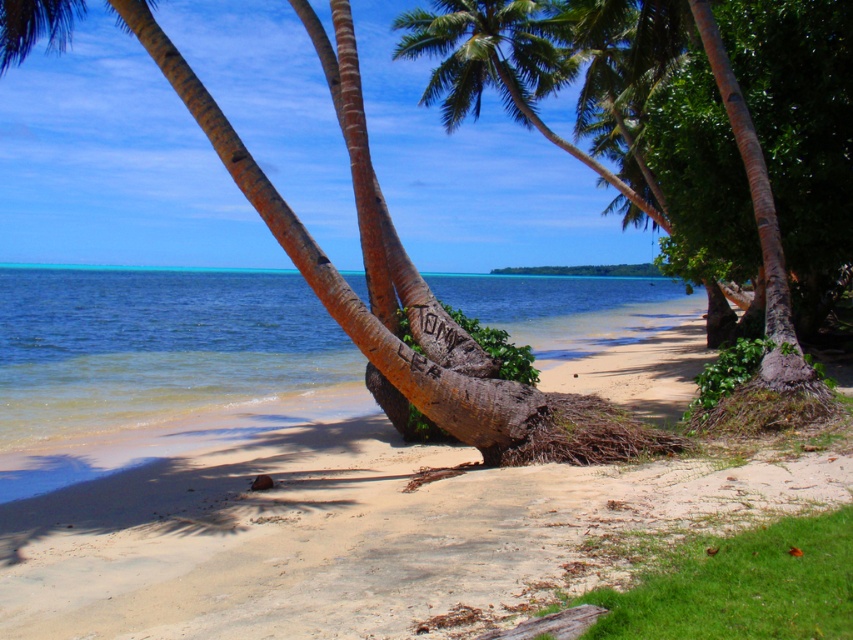
Does sandy beach at center have a lesser width compared to clear blue water at center?

Indeed, sandy beach at center has a lesser width compared to clear blue water at center.

Can you confirm if sandy beach at center is shorter than clear blue water at center?

Yes, sandy beach at center is shorter than clear blue water at center.

Between point (236, 532) and point (276, 380), which one is positioned behind?

Point (276, 380)

Identify the location of sandy beach at center. This screenshot has width=853, height=640. coord(357,536).